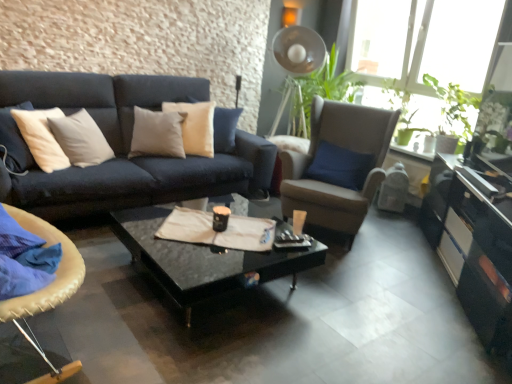
Question: Would you say glossy black cabinet at lower right is outside matte black coffee cup at center?

Choices:
 (A) yes
 (B) no

Answer: (A)

Question: Is matte black coffee cup at center completely or partially inside glossy black cabinet at lower right?

Choices:
 (A) no
 (B) yes

Answer: (A)

Question: Considering the relative sizes of glossy black cabinet at lower right and matte black coffee cup at center in the image provided, is glossy black cabinet at lower right bigger than matte black coffee cup at center?

Choices:
 (A) no
 (B) yes

Answer: (B)

Question: Can you confirm if glossy black cabinet at lower right is wider than matte black coffee cup at center?

Choices:
 (A) yes
 (B) no

Answer: (A)

Question: From the image's perspective, would you say glossy black cabinet at lower right is shown under matte black coffee cup at center?

Choices:
 (A) no
 (B) yes

Answer: (B)

Question: From a real-world perspective, is glossy black cabinet at lower right positioned above or below leather cushioned chair at lower left, the 1th chair in the front-to-back sequence?

Choices:
 (A) below
 (B) above

Answer: (A)

Question: Is glossy black cabinet at lower right spatially inside leather cushioned chair at lower left, the 1th chair in the front-to-back sequence, or outside of it?

Choices:
 (A) inside
 (B) outside

Answer: (B)

Question: Visually, is glossy black cabinet at lower right positioned to the left or to the right of leather cushioned chair at lower left, the 1th chair in the front-to-back sequence?

Choices:
 (A) right
 (B) left

Answer: (A)

Question: Considering the positions of glossy black cabinet at lower right and leather cushioned chair at lower left, positioned as the second chair in right-to-left order, in the image, is glossy black cabinet at lower right wider or thinner than leather cushioned chair at lower left, positioned as the second chair in right-to-left order,?

Choices:
 (A) wide
 (B) thin

Answer: (B)

Question: Considering the positions of point (23, 216) and point (205, 294), is point (23, 216) closer or farther from the camera than point (205, 294)?

Choices:
 (A) closer
 (B) farther

Answer: (A)

Question: From the image's perspective, is leather cushioned chair at lower left, which is counted as the 2th chair, starting from the back, positioned above or below black glossy coffee table at center?

Choices:
 (A) below
 (B) above

Answer: (B)

Question: From a real-world perspective, is leather cushioned chair at lower left, which is the first chair from left to right, physically located above or below black glossy coffee table at center?

Choices:
 (A) above
 (B) below

Answer: (A)

Question: In the image, is leather cushioned chair at lower left, positioned as the second chair in right-to-left order, positioned in front of or behind black glossy coffee table at center?

Choices:
 (A) behind
 (B) front

Answer: (B)

Question: In terms of size, does black glossy coffee table at center appear bigger or smaller than green matte plant at upper right?

Choices:
 (A) big
 (B) small

Answer: (A)

Question: From the image's perspective, relative to green matte plant at upper right, is black glossy coffee table at center above or below?

Choices:
 (A) below
 (B) above

Answer: (A)